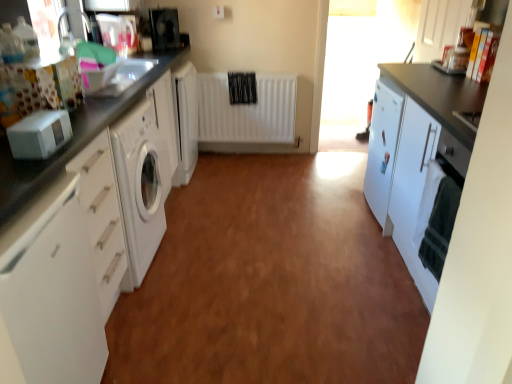
Question: In terms of width, does white matte radiator at center look wider or thinner when compared to transparent glass window screen at upper right?

Choices:
 (A) wide
 (B) thin

Answer: (B)

Question: Is white matte radiator at center in front of or behind transparent glass window screen at upper right in the image?

Choices:
 (A) behind
 (B) front

Answer: (A)

Question: Which of these objects is positioned closest to the transparent glass window screen at upper right?

Choices:
 (A) white glossy cabinet at left, acting as the first cabinetry starting from the left
 (B) white glossy cabinet at upper right, arranged as the 1th cabinetry when viewed from the right
 (C) white matte microwave at left, which is counted as the first appliance, starting from the bottom
 (D) white glossy washing machine at left
 (E) white matte cabinet at right, arranged as the 3th cabinetry when viewed from the left

Answer: (B)

Question: Estimate the real-world distances between objects in this image. Which object is closer to the white matte microwave at left, positioned as the first appliance in front-to-back order?

Choices:
 (A) white glossy cabinet at upper right, the fourth cabinetry viewed from the left
 (B) transparent glass window screen at upper right
 (C) white glossy cabinet at left, acting as the first cabinetry starting from the left
 (D) black glossy microwave at upper left, which is counted as the 2th appliance, starting from the bottom
 (E) white matte cabinet at right, arranged as the 3th cabinetry when viewed from the left

Answer: (C)